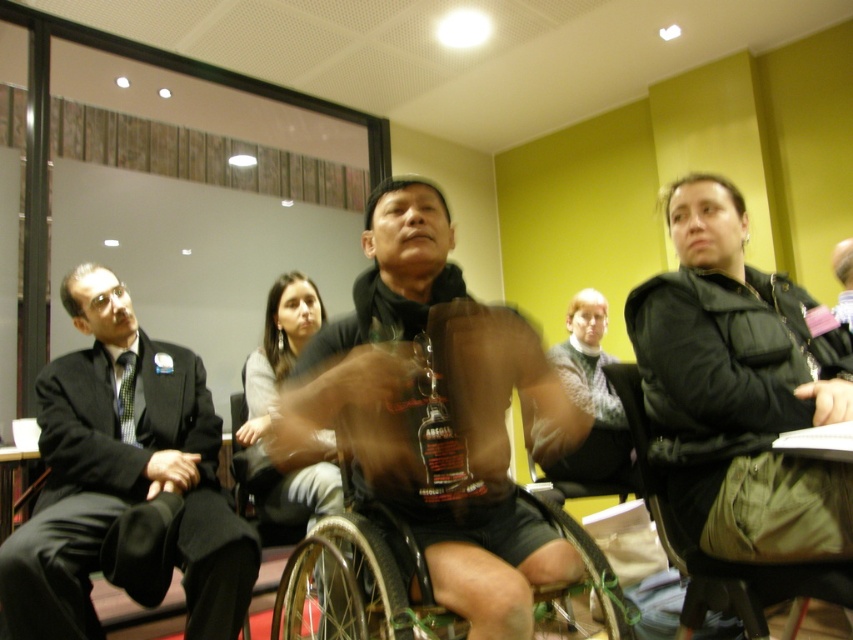
In the scene shown: You are organizing a space for a wheelchair user. The room has a matte black wheelchair at center and a black fabric chair at right. Which object takes up more space in the room?

The matte black wheelchair at center takes up more space in the room because it is bigger than the black fabric chair at right.

You are a photographer standing at the camera position. You want to take a clear photo of the black plastic wheelchair at center without motion blur. What should you do?

The black plastic wheelchair at center and camera are 1.12 meters apart from each other. To avoid motion blur, you should use a faster shutter speed or ensure the wheelchair remains still during the exposure.